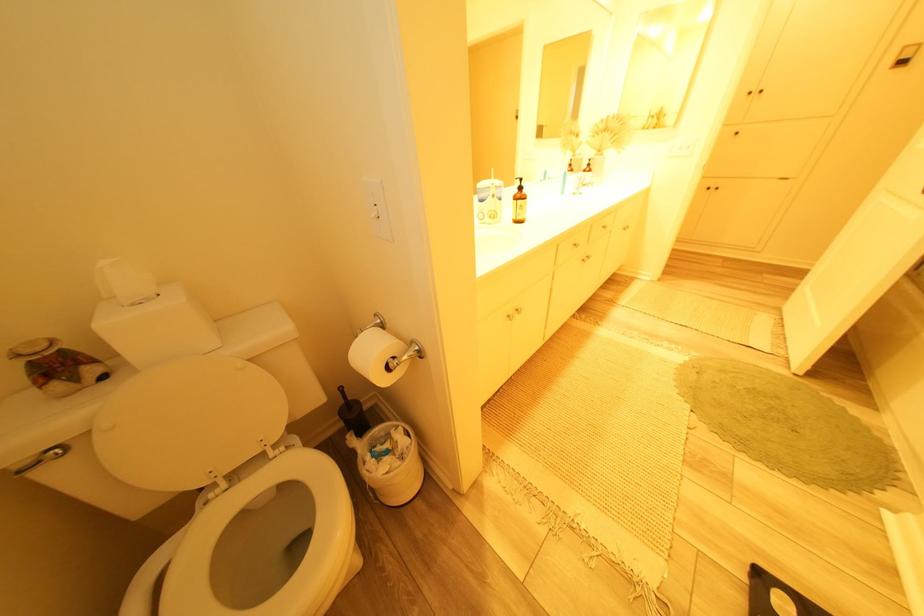
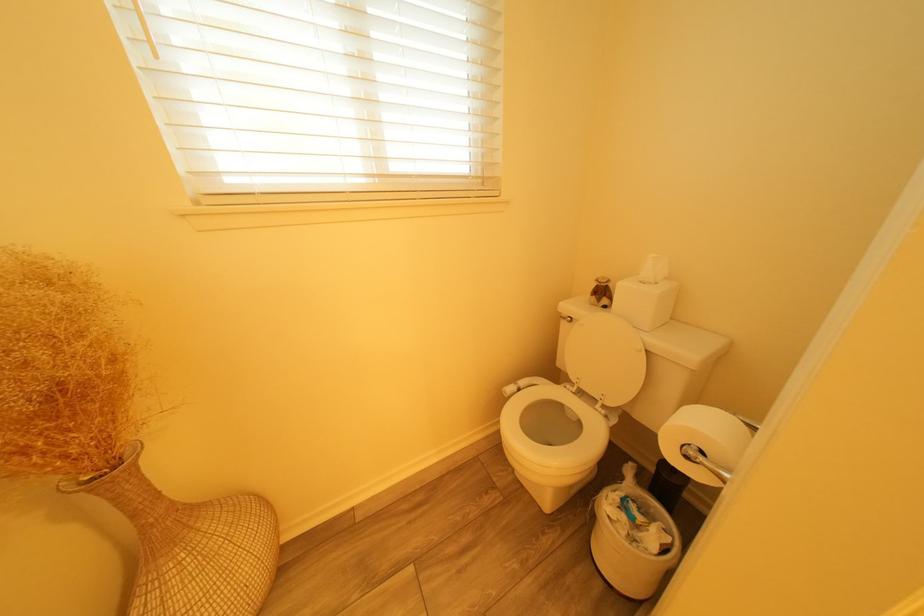
Where in the second image is the point corresponding to point (88, 381) from the first image?

(610, 302)